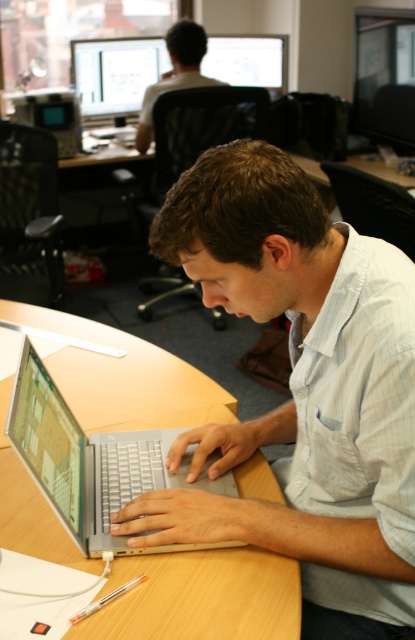
Can you confirm if matte silver laptop at center is positioned above silver metallic laptop at center?

Indeed, matte silver laptop at center is positioned over silver metallic laptop at center.

Can you confirm if matte silver laptop at center is wider than silver metallic laptop at center?

Yes, matte silver laptop at center is wider than silver metallic laptop at center.

Is point (310, 618) behind point (138, 442)?

No.

Where is `matte silver laptop at center`? This screenshot has height=640, width=415. matte silver laptop at center is located at coordinates click(302, 390).

Is point (163, 451) less distant than point (163, 84)?

Yes, it is in front of point (163, 84).

Locate an element on the screen. This screenshot has width=415, height=640. silver metallic laptop at center is located at coordinates (94, 464).

Who is taller, matte silver laptop at center or matte black monitor at upper right?

Standing taller between the two is matte silver laptop at center.

How distant is matte silver laptop at center from matte black monitor at upper right?

matte silver laptop at center is 8.40 feet from matte black monitor at upper right.

Is point (307, 179) in front of point (383, 28)?

Yes, it is.

You are a GUI agent. You are given a task and a screenshot of the screen. Output one action in this format:
    pyautogui.click(x=<x>, y=<y>)
    Task: Click on the matte silver laptop at center
    
    Given the screenshot: What is the action you would take?
    pyautogui.click(x=302, y=390)